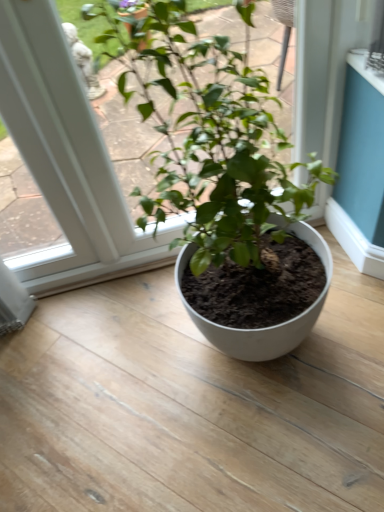
The width and height of the screenshot is (384, 512). I want to click on matte white pot at center, so click(221, 181).

In order to face matte white pot at center, should I rotate leftwards or rightwards?

To face it directly, rotate right by 5.124 degrees.

What do you see at coordinates (221, 181) in the screenshot?
I see `matte white pot at center` at bounding box center [221, 181].

Find the location of a particular element. matte white pot at center is located at coordinates (221, 181).